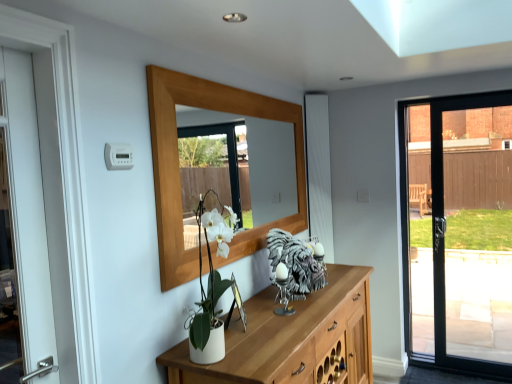
Describe the element at coordinates (236, 167) in the screenshot. I see `wooden mirror at upper center` at that location.

Where is `metallic silver picture frame at center`? The image size is (512, 384). metallic silver picture frame at center is located at coordinates (236, 305).

Locate an element on the screen. This screenshot has width=512, height=384. shiny silver sculpture at center is located at coordinates (296, 264).

The width and height of the screenshot is (512, 384). In order to click on wooden mirror at upper center in this screenshot , I will do `click(236, 167)`.

From the picture: Can you confirm if wooden mirror at upper center is taller than shiny silver sculpture at center?

Yes.

Does wooden mirror at upper center come in front of shiny silver sculpture at center?

Yes, wooden mirror at upper center is closer to the camera.

Is wooden mirror at upper center bigger or smaller than shiny silver sculpture at center?

Considering their sizes, wooden mirror at upper center takes up more space than shiny silver sculpture at center.

How distant is wooden mirror at upper center from shiny silver sculpture at center?

wooden mirror at upper center and shiny silver sculpture at center are 1.32 meters apart.

Considering the positions of point (270, 183) and point (231, 279), is point (270, 183) closer or farther from the camera than point (231, 279)?

Point (270, 183) appears to be farther away from the viewer than point (231, 279).

Is wooden mirror at upper center inside the boundaries of metallic silver picture frame at center, or outside?

wooden mirror at upper center is not enclosed by metallic silver picture frame at center.

Based on their sizes in the image, would you say wooden mirror at upper center is bigger or smaller than metallic silver picture frame at center?

Considering their sizes, wooden mirror at upper center takes up more space than metallic silver picture frame at center.

Considering the positions of objects metallic silver picture frame at center and shiny silver sculpture at center in the image provided, who is behind, metallic silver picture frame at center or shiny silver sculpture at center?

shiny silver sculpture at center is behind.

From the image's perspective, which is below, metallic silver picture frame at center or shiny silver sculpture at center?

metallic silver picture frame at center.

What are the coordinates of `picture frame below the shiny silver sculpture at center (from the image's perspective)` in the screenshot? It's located at (236, 305).

Considering the relative sizes of metallic silver picture frame at center and shiny silver sculpture at center in the image provided, is metallic silver picture frame at center wider than shiny silver sculpture at center?

No, metallic silver picture frame at center is not wider than shiny silver sculpture at center.

From a real-world perspective, which is physically below, shiny silver sculpture at center or metallic silver picture frame at center?

metallic silver picture frame at center.

From the picture: From the image's perspective, is shiny silver sculpture at center located beneath metallic silver picture frame at center?

No, from the image's perspective, shiny silver sculpture at center is not below metallic silver picture frame at center.

From the picture: Is shiny silver sculpture at center bigger or smaller than metallic silver picture frame at center?

Clearly, shiny silver sculpture at center is larger in size than metallic silver picture frame at center.

Is shiny silver sculpture at center outside of metallic silver picture frame at center?

Yes, shiny silver sculpture at center is located beyond the bounds of metallic silver picture frame at center.

Locate an element on the screen. animal below the wooden mirror at upper center (from the image's perspective) is located at coordinates (296, 264).

Is wooden mirror at upper center inside shiny silver sculpture at center?

No.

From the image's perspective, who appears lower, shiny silver sculpture at center or wooden mirror at upper center?

shiny silver sculpture at center appears lower in the image.

In terms of size, does metallic silver picture frame at center appear bigger or smaller than wooden mirror at upper center?

metallic silver picture frame at center is smaller than wooden mirror at upper center.

Where is `mirror that appears on the right of metallic silver picture frame at center`? mirror that appears on the right of metallic silver picture frame at center is located at coordinates (236, 167).

Does point (234, 288) lie in front of point (252, 119)?

Yes, point (234, 288) is in front of point (252, 119).

What are the coordinates of `animal lying on the right of wooden mirror at upper center` in the screenshot? It's located at (296, 264).

You are a GUI agent. You are given a task and a screenshot of the screen. Output one action in this format:
    pyautogui.click(x=<x>, y=<y>)
    Task: Click on the picture frame below the wooden mirror at upper center (from a real-world perspective)
    
    Given the screenshot: What is the action you would take?
    pyautogui.click(x=236, y=305)

In the scene shown: Looking at the image, which one is located closer to metallic silver picture frame at center, wooden mirror at upper center or shiny silver sculpture at center?

shiny silver sculpture at center lies closer to metallic silver picture frame at center than the other object.

Looking at this image, looking at the image, which one is located closer to metallic silver picture frame at center, shiny silver sculpture at center or wooden mirror at upper center?

Based on the image, shiny silver sculpture at center appears to be nearer to metallic silver picture frame at center.

From the image, which object appears to be farther from wooden mirror at upper center, metallic silver picture frame at center or shiny silver sculpture at center?

metallic silver picture frame at center is further to wooden mirror at upper center.

When comparing their distances from shiny silver sculpture at center, does metallic silver picture frame at center or wooden mirror at upper center seem closer?

metallic silver picture frame at center is closer to shiny silver sculpture at center.

Consider the image. Considering their positions, is wooden mirror at upper center positioned further to shiny silver sculpture at center than metallic silver picture frame at center?

Among the two, wooden mirror at upper center is located further to shiny silver sculpture at center.

From the picture: Looking at the image, which one is located further to wooden mirror at upper center, shiny silver sculpture at center or metallic silver picture frame at center?

Among the two, metallic silver picture frame at center is located further to wooden mirror at upper center.

Identify the location of animal between wooden mirror at upper center and metallic silver picture frame at center vertically. This screenshot has height=384, width=512. pyautogui.click(x=296, y=264).